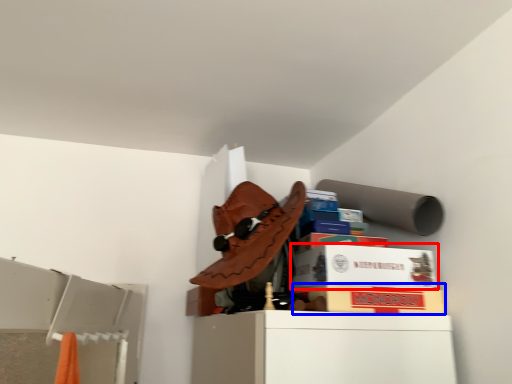
Question: Which object appears farthest to the camera in this image, cardboard box (highlighted by a red box) or cardboard box (highlighted by a blue box)?

Choices:
 (A) cardboard box
 (B) cardboard box

Answer: (A)